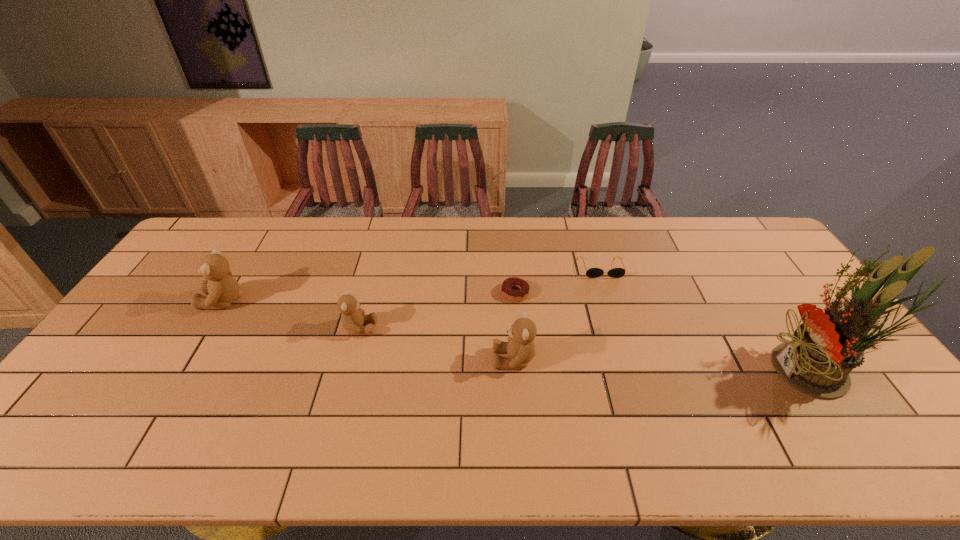
Please show where to add a teddy bear on the right while keeping spacing even. Please provide its 2D coordinates. Your answer should be formatted as a tuple, i.e. [(x, y)], where the tuple contains the x and y coordinates of a point satisfying the conditions above.

[(691, 395)]